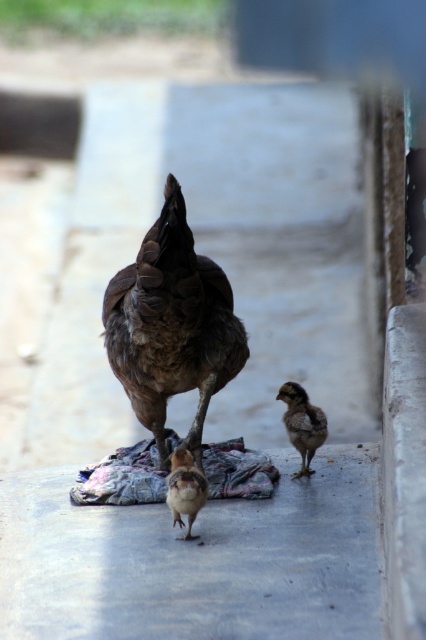
Question: Which point appears farthest from the camera in this image?

Choices:
 (A) (403, 422)
 (B) (288, 426)
 (C) (161, 524)
 (D) (201, 268)

Answer: (B)

Question: Is brown feathered chicken at center above smooth concrete curb at right?

Choices:
 (A) no
 (B) yes

Answer: (B)

Question: Considering the real-world distances, which object is farthest from the brown fluffy chick at center?

Choices:
 (A) brown feathered bird at center
 (B) smooth concrete curb at right
 (C) brown feathered chicken at center
 (D) gray concrete at center

Answer: (D)

Question: Is brown feathered chicken at center positioned behind brown fluffy chick at center?

Choices:
 (A) yes
 (B) no

Answer: (B)

Question: Is brown feathered chicken at center to the left of brown feathered bird at center from the viewer's perspective?

Choices:
 (A) yes
 (B) no

Answer: (A)

Question: Based on their relative distances, which object is nearer to the gray concrete at center?

Choices:
 (A) brown fluffy chick at center
 (B) smooth concrete curb at right
 (C) brown feathered bird at center
 (D) brown feathered chicken at center

Answer: (C)